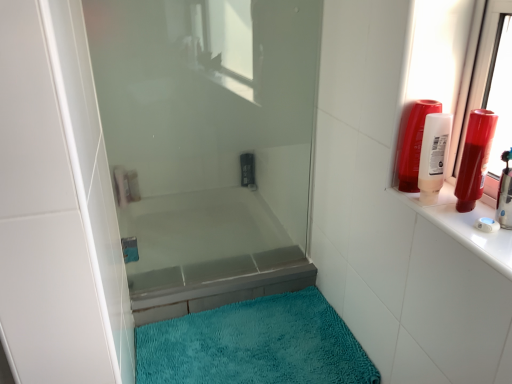
Question: Is matte white bottle at upper right, the second toiletry when ordered from right to left, next to translucent plastic shampoo bottle at upper right, arranged as the fourth toiletry when viewed from the left, and touching it?

Choices:
 (A) yes
 (B) no

Answer: (A)

Question: Is matte white bottle at upper right, placed as the 5th toiletry when sorted from left to right, facing towards translucent plastic shampoo bottle at upper right, which is the fourth toiletry from back to front?

Choices:
 (A) no
 (B) yes

Answer: (B)

Question: Does matte white bottle at upper right, the 2th toiletry in the front-to-back sequence, appear on the right side of translucent plastic shampoo bottle at upper right, positioned as the third toiletry in front-to-back order?

Choices:
 (A) yes
 (B) no

Answer: (A)

Question: Is matte white bottle at upper right, the second toiletry when ordered from right to left, oriented away from translucent plastic shampoo bottle at upper right, which is the fourth toiletry from back to front?

Choices:
 (A) yes
 (B) no

Answer: (A)

Question: Considering the relative sizes of matte white bottle at upper right, the second toiletry when ordered from right to left, and translucent plastic shampoo bottle at upper right, which is the fourth toiletry from back to front, in the image provided, is matte white bottle at upper right, the second toiletry when ordered from right to left, shorter than translucent plastic shampoo bottle at upper right, which is the fourth toiletry from back to front,?

Choices:
 (A) no
 (B) yes

Answer: (B)

Question: Is matte white bottle at upper right, the second toiletry when ordered from right to left, positioned before translucent plastic shampoo bottle at upper right, which is the fourth toiletry from back to front?

Choices:
 (A) yes
 (B) no

Answer: (A)

Question: Is matte white bottle at upper right, placed as the 5th toiletry when sorted from left to right, positioned in front of teal plush bath mat at lower center?

Choices:
 (A) yes
 (B) no

Answer: (A)

Question: Would you say teal plush bath mat at lower center is part of matte white bottle at upper right, the second toiletry when ordered from right to left,'s contents?

Choices:
 (A) yes
 (B) no

Answer: (B)

Question: From the image's perspective, is matte white bottle at upper right, the 2th toiletry in the front-to-back sequence, located above teal plush bath mat at lower center?

Choices:
 (A) yes
 (B) no

Answer: (A)

Question: From a real-world perspective, is matte white bottle at upper right, which appears as the 5th toiletry when viewed from the back, located beneath teal plush bath mat at lower center?

Choices:
 (A) no
 (B) yes

Answer: (A)

Question: Is matte white bottle at upper right, the 2th toiletry in the front-to-back sequence, positioned far away from teal plush bath mat at lower center?

Choices:
 (A) no
 (B) yes

Answer: (A)

Question: Is matte white bottle at upper right, placed as the 5th toiletry when sorted from left to right, touching teal plush bath mat at lower center?

Choices:
 (A) no
 (B) yes

Answer: (A)

Question: Can you confirm if teal plush bath mat at lower center is bigger than shiny red tube at upper right, arranged as the 1th toiletry when viewed from the front?

Choices:
 (A) yes
 (B) no

Answer: (A)